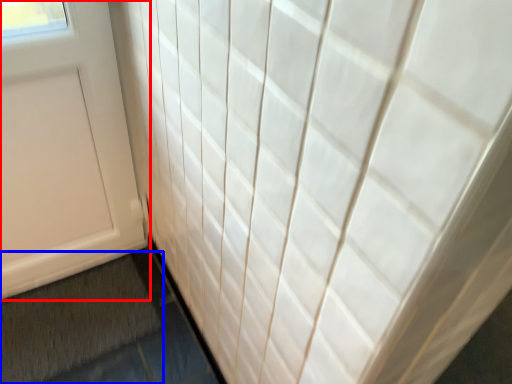
Question: Which object appears farthest to the camera in this image, door (highlighted by a red box) or bath mat (highlighted by a blue box)?

Choices:
 (A) door
 (B) bath mat

Answer: (B)